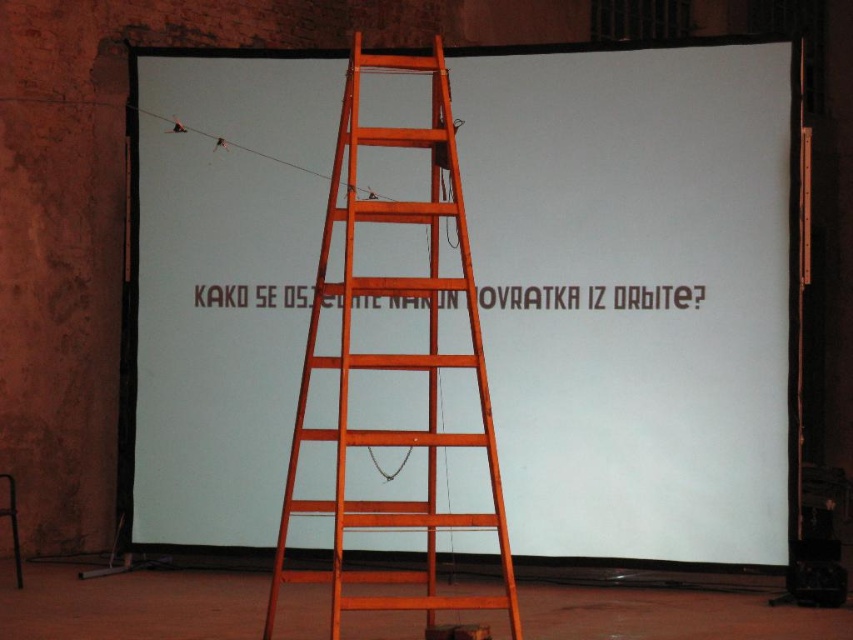
This screenshot has width=853, height=640. Identify the location of white matte projection screen at center. tap(634, 296).

Who is positioned more to the left, white matte projection screen at center or wooden ladder at center?

From the viewer's perspective, wooden ladder at center appears more on the left side.

Is point (538, 180) farther from camera compared to point (380, 512)?

That is True.

Where is `white matte projection screen at center`? Image resolution: width=853 pixels, height=640 pixels. white matte projection screen at center is located at coordinates (634, 296).